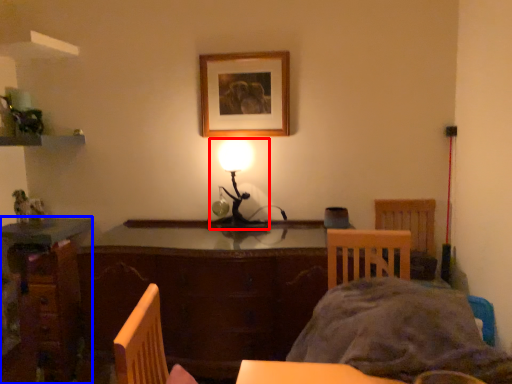
Question: Which object is further to the camera taking this photo, lamp (highlighted by a red box) or desk (highlighted by a blue box)?

Choices:
 (A) lamp
 (B) desk

Answer: (B)